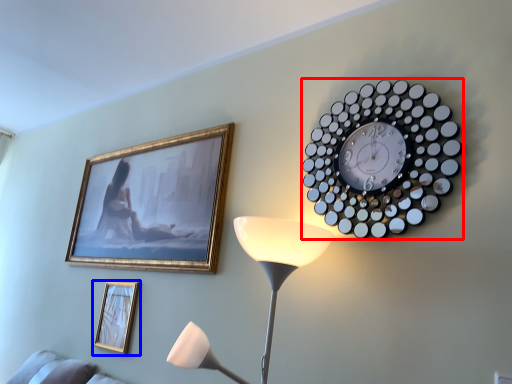
Question: Which point is closer to the camera, wall clock (highlighted by a red box) or picture frame (highlighted by a blue box)?

Choices:
 (A) wall clock
 (B) picture frame

Answer: (A)